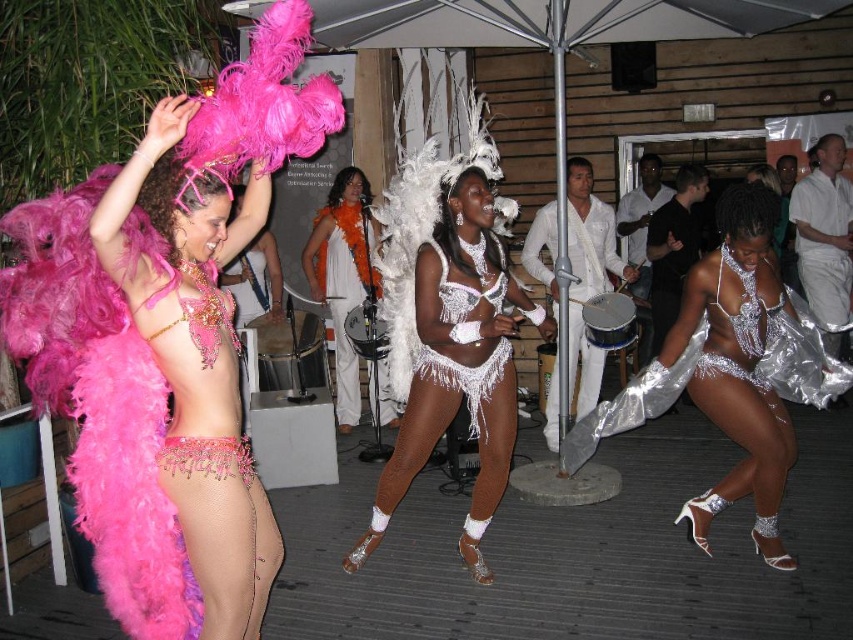
Who is positioned more to the right, silver metallic bikini at lower right or silver metallic dress at right?

silver metallic dress at right is more to the right.

Can you confirm if silver metallic bikini at lower right is smaller than silver metallic dress at right?

Incorrect, silver metallic bikini at lower right is not smaller in size than silver metallic dress at right.

Does point (729, 417) come behind point (819, 173)?

No.

Where is `silver metallic bikini at lower right`? This screenshot has height=640, width=853. silver metallic bikini at lower right is located at coordinates (730, 371).

Is pink feather boa at left thinner than white fabric umbrella at upper center?

Yes.

Is the position of pink feather boa at left more distant than that of white fabric umbrella at upper center?

No.

Who is more forward, (119, 484) or (335, 26)?

Point (119, 484) is in front.

Where is `pink feather boa at left`? Image resolution: width=853 pixels, height=640 pixels. pink feather boa at left is located at coordinates (99, 406).

Which is above, orange feather boa at center or silver metallic dress at right?

silver metallic dress at right

Does orange feather boa at center have a lesser height compared to silver metallic dress at right?

No, orange feather boa at center is not shorter than silver metallic dress at right.

Describe the element at coordinates (343, 275) in the screenshot. This screenshot has width=853, height=640. I see `orange feather boa at center` at that location.

Find the location of a particular element. The width and height of the screenshot is (853, 640). orange feather boa at center is located at coordinates (343, 275).